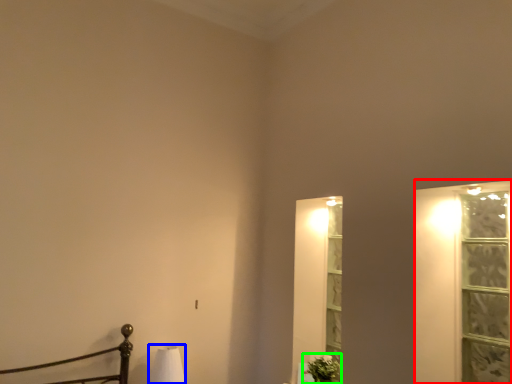
Question: Which is nearer to the window frame (highlighted by a red box)? table lamp (highlighted by a blue box) or plant (highlighted by a green box).

Choices:
 (A) table lamp
 (B) plant

Answer: (B)